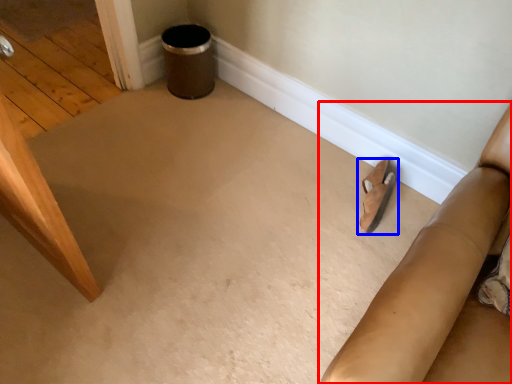
Question: Which point is closer to the camera, furniture (highlighted by a red box) or footwear (highlighted by a blue box)?

Choices:
 (A) furniture
 (B) footwear

Answer: (A)